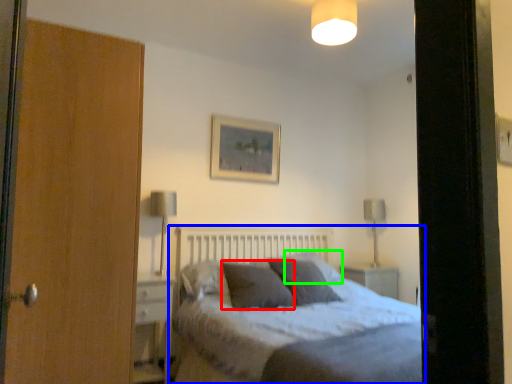
Question: Which object is positioned closest to pillow (highlighted by a red box)? Select from bed (highlighted by a blue box) and pillow (highlighted by a green box).

Choices:
 (A) bed
 (B) pillow

Answer: (A)